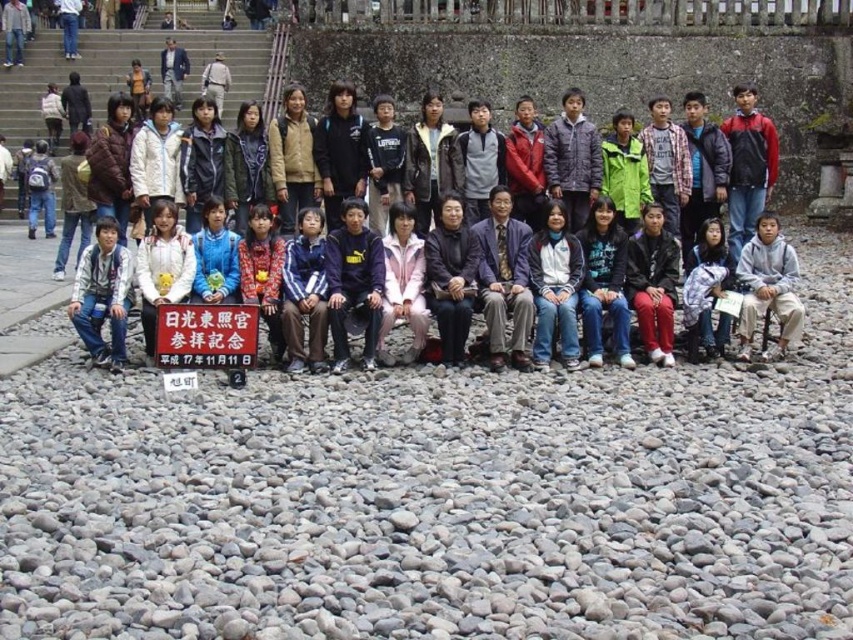
What is the color of the sign located at the coordinates point (728, 168)?

The point (728, 168) corresponds to a matte black sign at center.

You are standing at the point marked by the coordinates point (428, 504). What material are you standing on?

You are standing on gray gravel at lower center.

Where is the gray gravel at lower center located in the image?

The gray gravel at lower center is located at point (428,504).